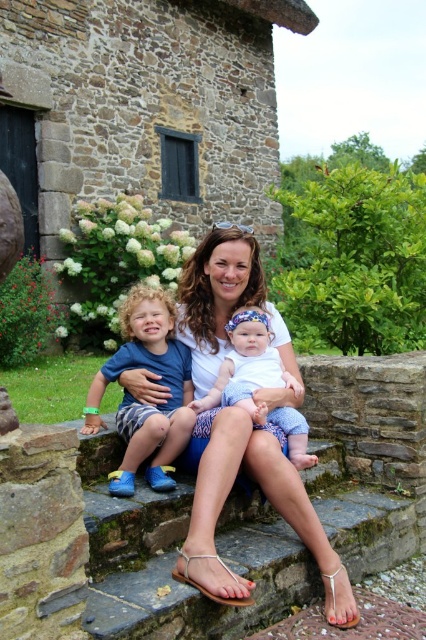
Question: Does white fabric shirt at center appear over blue fabric shorts at left?

Choices:
 (A) yes
 (B) no

Answer: (B)

Question: Does blue fabric shorts at left have a larger size compared to white cotton shirt at center?

Choices:
 (A) yes
 (B) no

Answer: (A)

Question: Which of the following is the farthest from the observer?

Choices:
 (A) blue fabric shorts at left
 (B) white cotton shirt at center
 (C) white fabric shirt at center

Answer: (B)

Question: Can you confirm if white fabric shirt at center is positioned to the right of white cotton shirt at center?

Choices:
 (A) no
 (B) yes

Answer: (A)

Question: Which of the following is the farthest from the observer?

Choices:
 (A) (215, 385)
 (B) (213, 227)
 (C) (150, 317)

Answer: (B)

Question: Which is farther from the white fabric shirt at center?

Choices:
 (A) blue fabric shorts at left
 (B) white cotton shirt at center

Answer: (A)